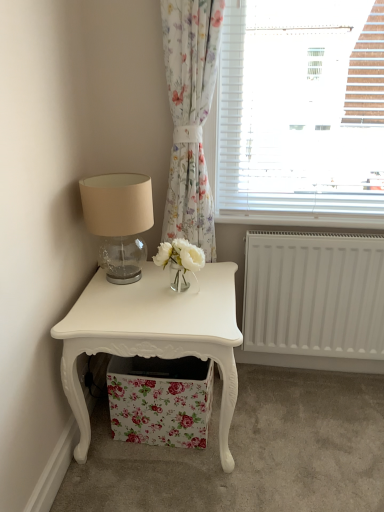
Locate an element on the screen. The width and height of the screenshot is (384, 512). free space in front of matte glass table lamp at upper left is located at coordinates (124, 304).